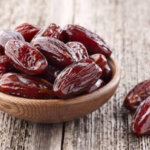
Image resolution: width=150 pixels, height=150 pixels. In order to click on medium wood table section in this screenshot , I will do `click(104, 131)`.